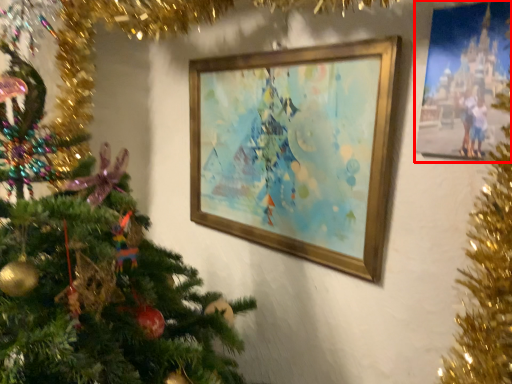
Question: Observing the image, what is the correct spatial positioning of picture frame (annotated by the red box) in reference to picture frame?

Choices:
 (A) right
 (B) left

Answer: (A)